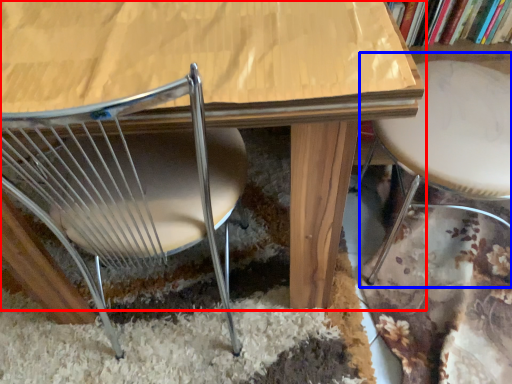
Question: Among these objects, which one is farthest to the camera, table (highlighted by a red box) or bar stool (highlighted by a blue box)?

Choices:
 (A) table
 (B) bar stool

Answer: (A)